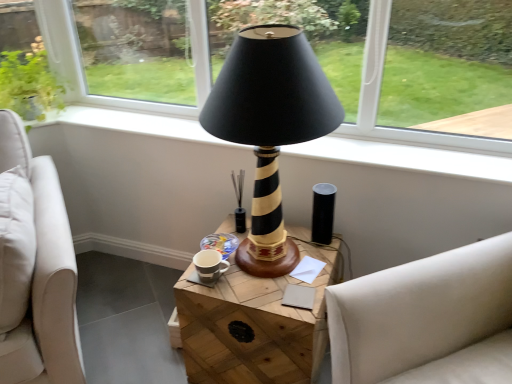
Question: Is point (184, 61) positioned closer to the camera than point (311, 317)?

Choices:
 (A) closer
 (B) farther

Answer: (B)

Question: Considering their positions, is transparent glass at upper left located in front of or behind wooden at center?

Choices:
 (A) front
 (B) behind

Answer: (B)

Question: Based on their relative distances, which object is nearer to the black glossy candle holder at center?

Choices:
 (A) transparent glass at upper left
 (B) wooden at center
 (C) white fabric studio couch at right
 (D) black striped wood lamp at center

Answer: (B)

Question: Which object is positioned farthest from the wooden at center?

Choices:
 (A) transparent glass at upper left
 (B) black glossy candle holder at center
 (C) white fabric studio couch at right
 (D) black striped wood lamp at center

Answer: (A)